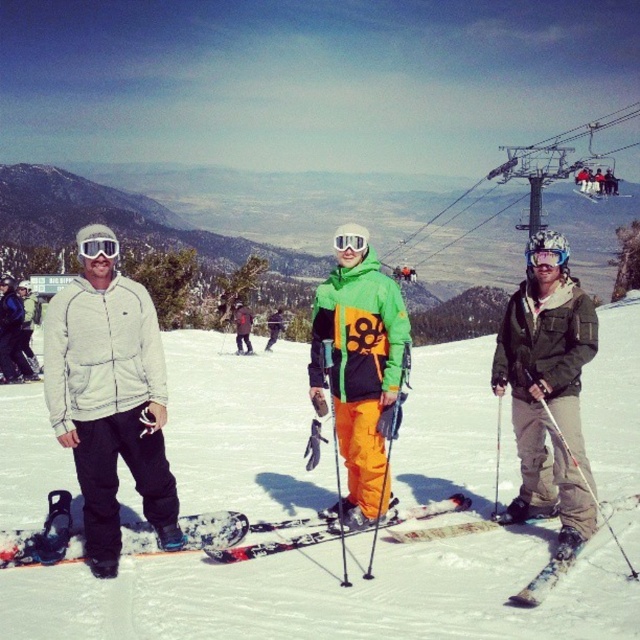
Between neon orange ski pants at center and orange matte ski at center, which one has more height?

Standing taller between the two is neon orange ski pants at center.

Does neon orange ski pants at center appear over orange matte ski at center?

Correct, neon orange ski pants at center is located above orange matte ski at center.

Is point (374, 502) positioned before point (241, 547)?

That is False.

You are a GUI agent. You are given a task and a screenshot of the screen. Output one action in this format:
    pyautogui.click(x=<x>, y=<y>)
    Task: Click on the neon orange ski pants at center
    This screenshot has height=640, width=640.
    Given the screenshot: What is the action you would take?
    pyautogui.click(x=358, y=364)

Who is more distant from viewer, (58, 545) or (512, 148)?

Point (512, 148)

Does orange matte snowboard at lower left have a larger size compared to metallic cable car at upper center?

Actually, orange matte snowboard at lower left might be smaller than metallic cable car at upper center.

Between point (65, 502) and point (403, 243), which one is positioned in front?

Point (65, 502) is in front.

The height and width of the screenshot is (640, 640). In order to click on orange matte snowboard at lower left in this screenshot , I will do `click(44, 538)`.

Is point (161, 406) farther from viewer compared to point (440, 212)?

No, (161, 406) is in front of (440, 212).

Locate an element on the screen. The width and height of the screenshot is (640, 640). white matte jacket at left is located at coordinates (109, 403).